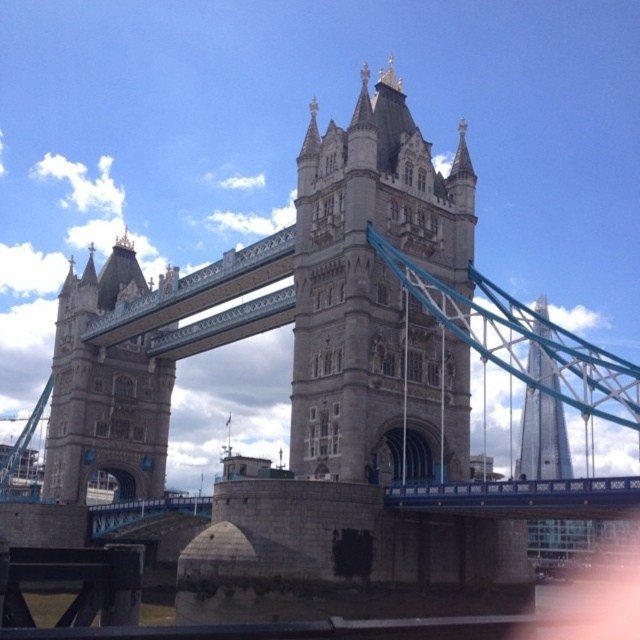
Question: Which object is closer to the camera taking this photo?

Choices:
 (A) stone tower at center
 (B) gray stone tower at center

Answer: (B)

Question: Does gray stone tower at center have a greater width compared to stone tower at center?

Choices:
 (A) no
 (B) yes

Answer: (B)

Question: Is gray stone tower at center to the left of stone tower at center from the viewer's perspective?

Choices:
 (A) yes
 (B) no

Answer: (B)

Question: Among these objects, which one is nearest to the camera?

Choices:
 (A) gray stone tower at center
 (B) stone tower at center

Answer: (A)

Question: Is gray stone tower at center closer to the viewer compared to stone tower at center?

Choices:
 (A) no
 (B) yes

Answer: (B)